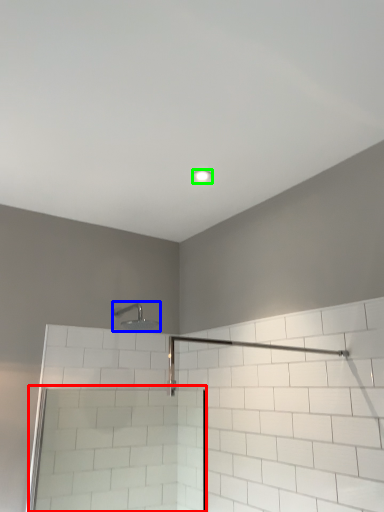
Question: Which object is the closest to the screen door (highlighted by a red box)? Choose among these: shower (highlighted by a blue box) or light fixture (highlighted by a green box).

Choices:
 (A) shower
 (B) light fixture

Answer: (A)